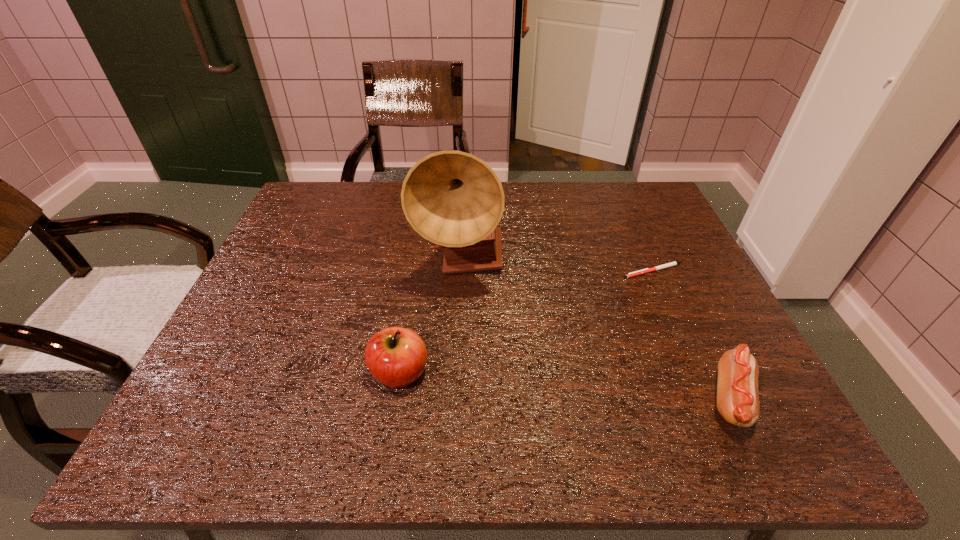
This screenshot has width=960, height=540. What are the coordinates of `empty location between the tallest object and the pen` in the screenshot? It's located at (557, 267).

This screenshot has height=540, width=960. Identify the location of vacant space in between the tallest object and the second tallest object. (430, 319).

Locate an element on the screen. The image size is (960, 540). object that is the third closest one to the sausage is located at coordinates (396, 357).

Locate an element on the screen. The height and width of the screenshot is (540, 960). the third closest object to the apple is located at coordinates (737, 387).

Identify the location of vacant position in the image that satisfies the following two spatial constraints: 1. on the front side of the second shortest object; 2. on the left side of the apple. The width and height of the screenshot is (960, 540). (396, 399).

Locate an element on the screen. vacant space that satisfies the following two spatial constraints: 1. on the back side of the second tallest object; 2. on the left side of the phonograph record is located at coordinates (418, 264).

Where is `free spot that satisfies the following two spatial constraints: 1. on the front side of the sausage; 2. on the left side of the tallest object`? Image resolution: width=960 pixels, height=540 pixels. free spot that satisfies the following two spatial constraints: 1. on the front side of the sausage; 2. on the left side of the tallest object is located at coordinates (453, 399).

This screenshot has height=540, width=960. What are the coordinates of `free space that satisfies the following two spatial constraints: 1. on the front side of the phonograph record; 2. on the right side of the sausage` in the screenshot? It's located at (453, 399).